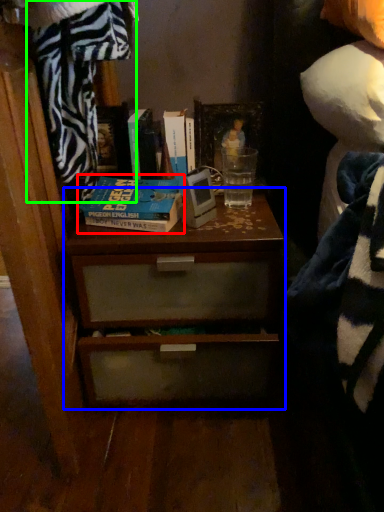
Question: Which is farther away from book (highlighted by a red box)? chest of drawers (highlighted by a blue box) or blanket (highlighted by a green box)?

Choices:
 (A) chest of drawers
 (B) blanket

Answer: (A)